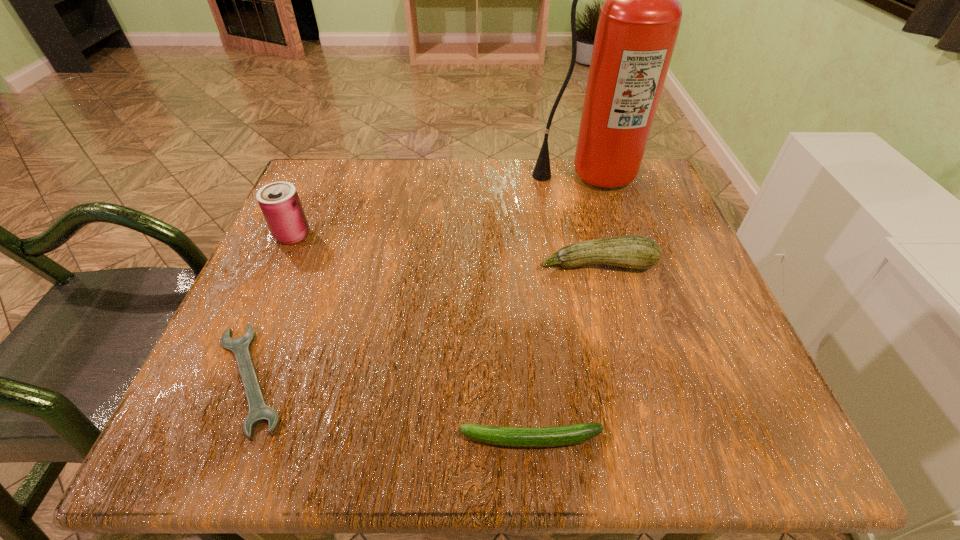
Locate an element on the screen. The height and width of the screenshot is (540, 960). wrench located at the left edge is located at coordinates (259, 412).

This screenshot has height=540, width=960. I want to click on fire extinguisher that is at the right edge, so click(x=639, y=21).

At what (x,y) coordinates should I click in order to perform the action: click on zucchini that is at the right edge. Please return your answer as a coordinate pair (x, y). The height and width of the screenshot is (540, 960). Looking at the image, I should click on (638, 252).

I want to click on object that is positioned at the near left corner, so click(259, 412).

You are a GUI agent. You are given a task and a screenshot of the screen. Output one action in this format:
    pyautogui.click(x=<x>, y=<y>)
    Task: Click on the object at the far right corner
    
    Given the screenshot: What is the action you would take?
    pos(639,21)

Image resolution: width=960 pixels, height=540 pixels. In the image, there is a desktop. What are the coordinates of `vacant space at the far edge` in the screenshot? It's located at (372, 210).

At what (x,y) coordinates should I click in order to perform the action: click on free space at the near edge. Please return your answer as a coordinate pair (x, y). Image resolution: width=960 pixels, height=540 pixels. Looking at the image, I should click on (435, 442).

I want to click on vacant space at the left edge of the desktop, so click(269, 253).

The height and width of the screenshot is (540, 960). I want to click on free point at the right edge, so click(x=673, y=261).

In the image, there is a desktop. Where is `vacant space at the far left corner`? This screenshot has width=960, height=540. vacant space at the far left corner is located at coordinates click(x=317, y=168).